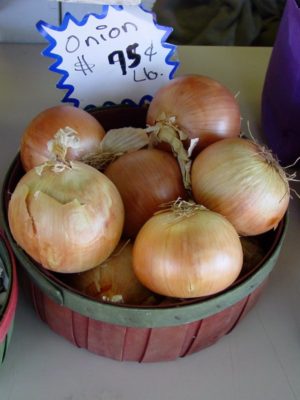
Image resolution: width=300 pixels, height=400 pixels. Find the location of `white table top`. white table top is located at coordinates (249, 364).